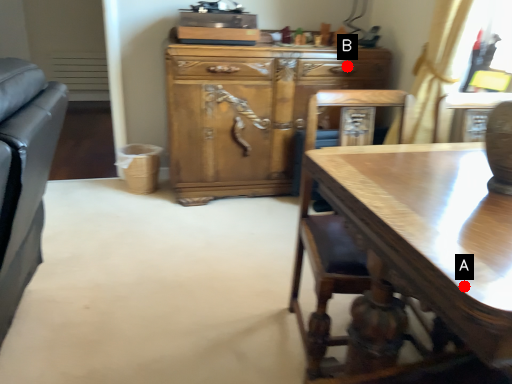
Question: Two points are circled on the image, labeled by A and B beside each circle. Which point appears farthest from the camera in this image?

Choices:
 (A) A is further
 (B) B is further

Answer: (B)